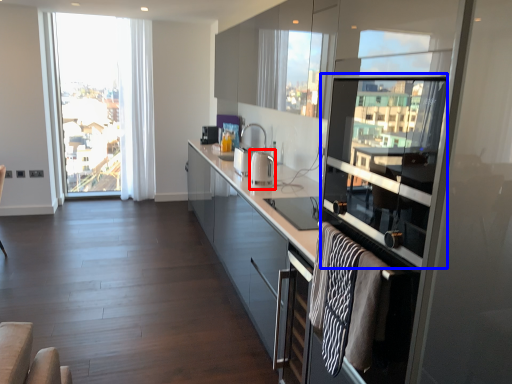
Question: Which point is closer to the camera, appliance (highlighted by a red box) or window screen (highlighted by a blue box)?

Choices:
 (A) appliance
 (B) window screen

Answer: (B)